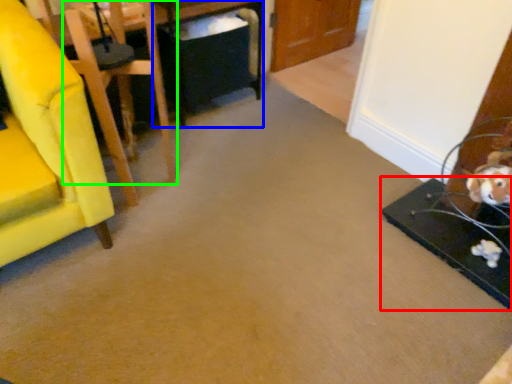
Question: Based on their relative distances, which object is farther from table (highlighted by a red box)? Choose from table (highlighted by a blue box) and chair (highlighted by a green box).

Choices:
 (A) table
 (B) chair

Answer: (A)